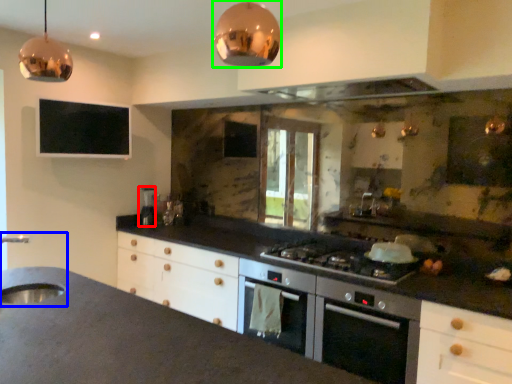
Question: Based on their relative distances, which object is farther from appliance (highlighted by a red box)? Choose from sink (highlighted by a blue box) and light fixture (highlighted by a green box).

Choices:
 (A) sink
 (B) light fixture

Answer: (B)